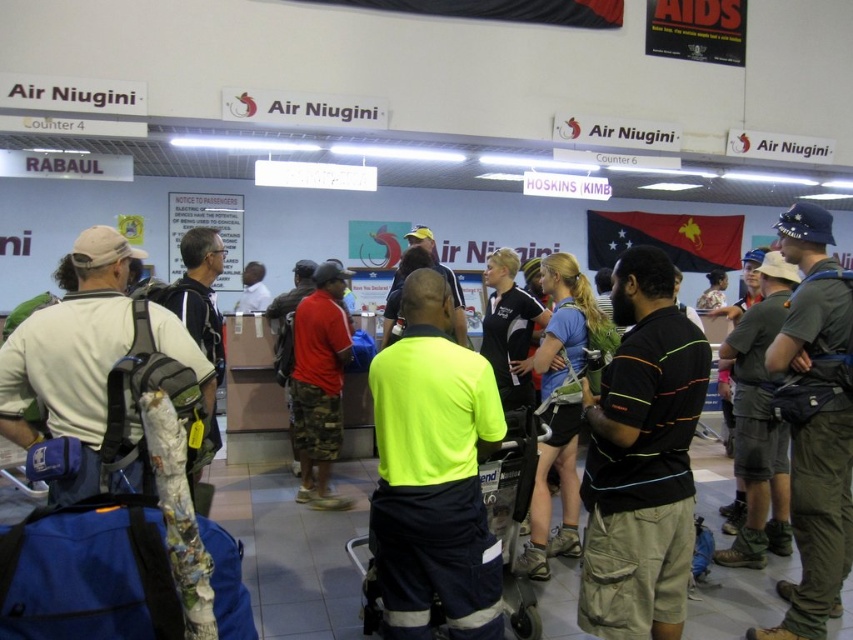
Question: Is neon yellow shirt at center above red cotton shirt at center?

Choices:
 (A) yes
 (B) no

Answer: (B)

Question: Is neon yellow shirt at center above red cotton shirt at center?

Choices:
 (A) yes
 (B) no

Answer: (B)

Question: Among these points, which one is farthest from the camera?

Choices:
 (A) (299, 412)
 (B) (495, 609)

Answer: (A)

Question: Is neon yellow shirt at center thinner than red cotton shirt at center?

Choices:
 (A) yes
 (B) no

Answer: (B)